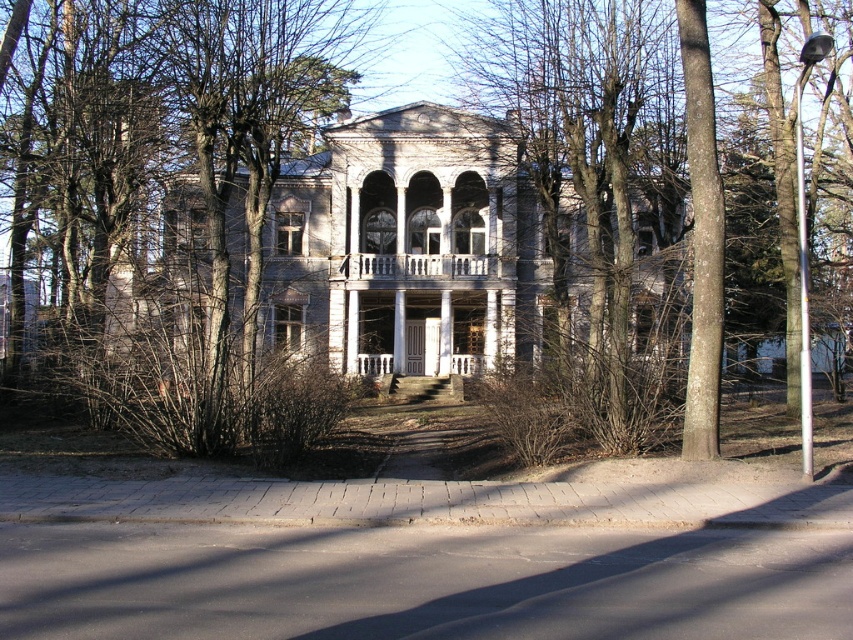
Who is higher up, gray stone mansion at center or white painted wood porch at center?

gray stone mansion at center is above.

Which of these two, gray stone mansion at center or white painted wood porch at center, stands taller?

Standing taller between the two is gray stone mansion at center.

Is point (354, 211) more distant than point (422, 372)?

No, it is not.

The height and width of the screenshot is (640, 853). I want to click on gray stone mansion at center, so click(x=405, y=243).

Based on the photo, between brown bark tree at center and white painted wood porch at center, which one appears on the right side from the viewer's perspective?

brown bark tree at center

Between brown bark tree at center and white painted wood porch at center, which one appears on the left side from the viewer's perspective?

From the viewer's perspective, white painted wood porch at center appears more on the left side.

Does point (125, 202) lie in front of point (364, 353)?

Yes, point (125, 202) is in front of point (364, 353).

Find the location of `brown bark tree at center`. brown bark tree at center is located at coordinates (373, 212).

Measure the distance between gray stone mansion at center and white wooden porch at center.

A distance of 4.03 meters exists between gray stone mansion at center and white wooden porch at center.

Image resolution: width=853 pixels, height=640 pixels. I want to click on gray stone mansion at center, so pos(405,243).